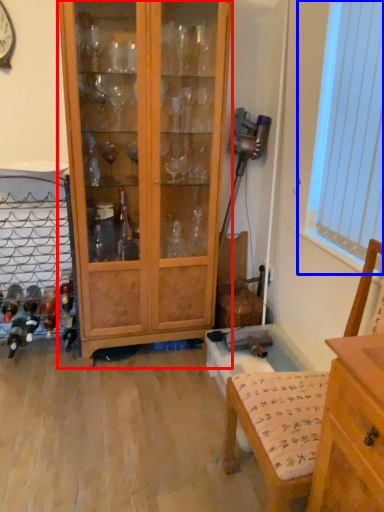
Question: Which object appears farthest to the camera in this image, cabinetry (highlighted by a red box) or window screen (highlighted by a blue box)?

Choices:
 (A) cabinetry
 (B) window screen

Answer: (A)